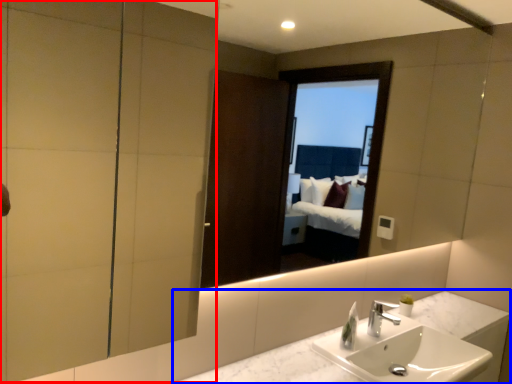
Question: Which object is further to the camera taking this photo, screen door (highlighted by a red box) or counter top (highlighted by a blue box)?

Choices:
 (A) screen door
 (B) counter top

Answer: (B)